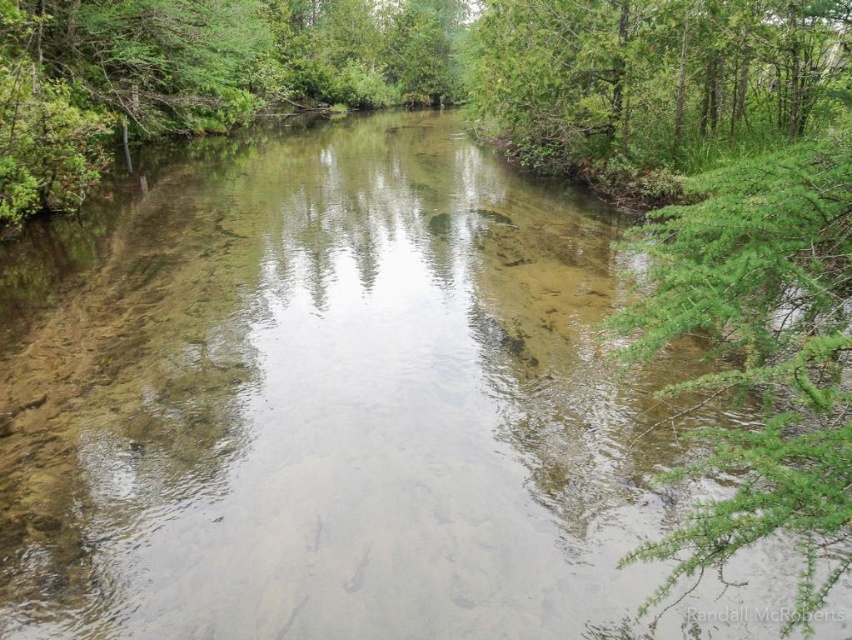
Question: Considering the relative positions of green leafy branch at right and green leafy tree at upper right in the image provided, where is green leafy branch at right located with respect to green leafy tree at upper right?

Choices:
 (A) left
 (B) right

Answer: (A)

Question: Which of the following is the closest to the observer?

Choices:
 (A) (522, 1)
 (B) (763, 353)

Answer: (B)

Question: Can you confirm if green leafy branch at right is positioned to the right of green leafy tree at upper right?

Choices:
 (A) no
 (B) yes

Answer: (A)

Question: Observing the image, what is the correct spatial positioning of green leafy branch at right in reference to green leafy tree at upper right?

Choices:
 (A) right
 (B) left

Answer: (B)

Question: Which point appears closest to the camera in this image?

Choices:
 (A) (740, 65)
 (B) (787, 346)

Answer: (B)

Question: Which point is farther from the camera taking this photo?

Choices:
 (A) (513, 83)
 (B) (850, 556)

Answer: (A)